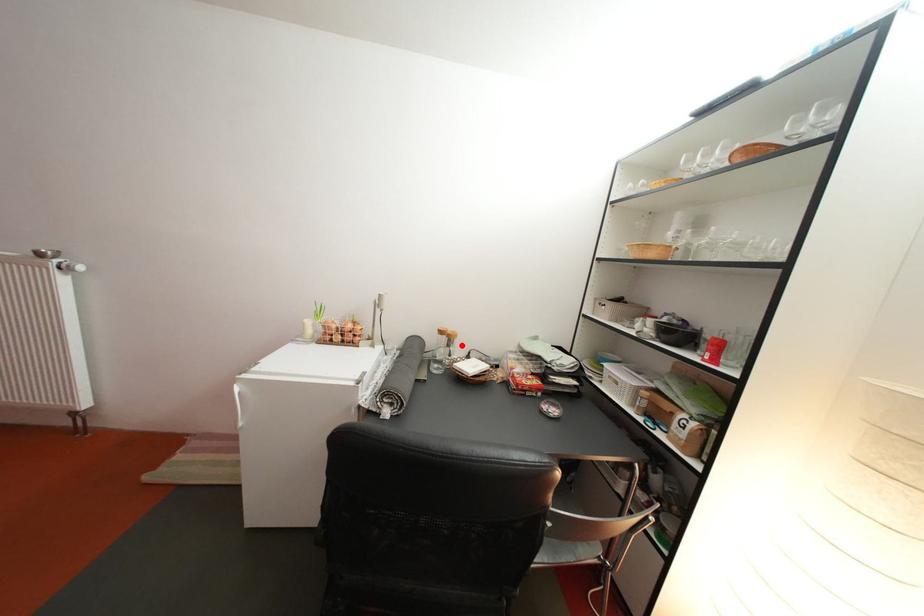
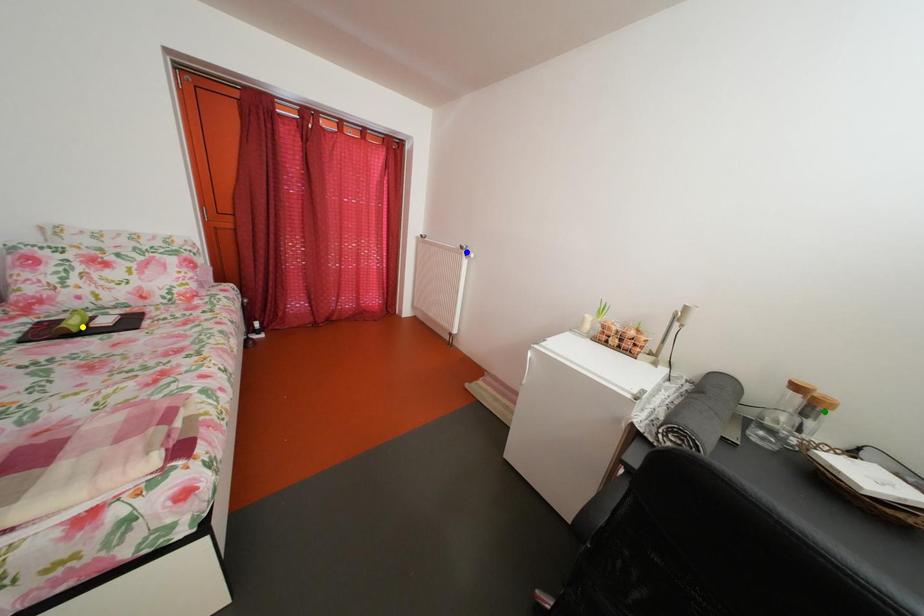
Question: I am providing you with two images of the same scene from different viewpoints. A red point is marked on the first image. You are given multiple points on the second image. Which mark in image 2 goes with the point in image 1?

Choices:
 (A) yellow point
 (B) blue point
 (C) green point

Answer: (C)